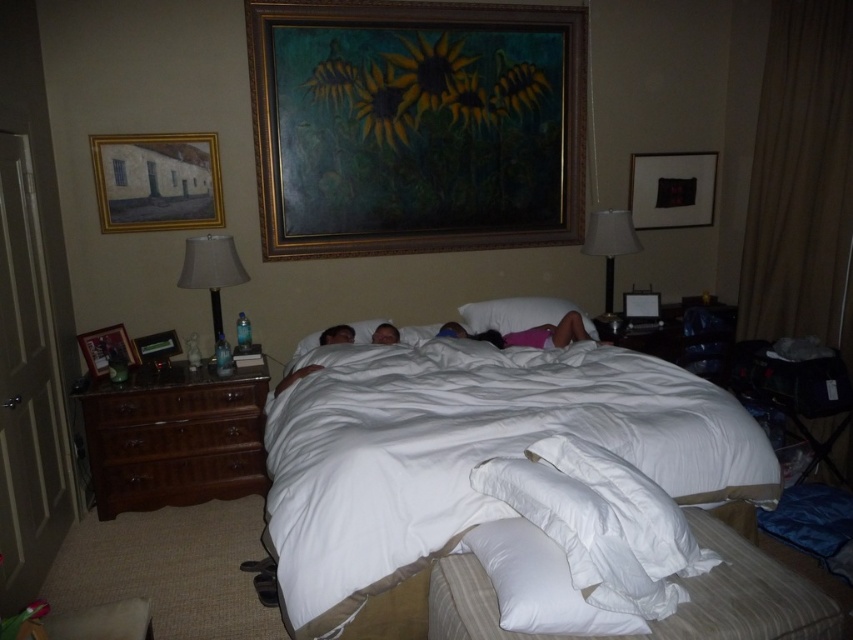
Question: Is black fabric picture frame at upper right below matte black picture frame at center?

Choices:
 (A) no
 (B) yes

Answer: (A)

Question: Can you confirm if white soft bedcover at center is positioned below matte black picture frame at left?

Choices:
 (A) yes
 (B) no

Answer: (A)

Question: Based on their relative distances, which object is farther from the white soft pillow at lower center?

Choices:
 (A) smooth skin face at center
 (B) gold-framed painting at upper center

Answer: (B)

Question: Which of the following is the farthest from the observer?

Choices:
 (A) white soft bedcover at center
 (B) brown wood dresser at left
 (C) matte black picture frame at center

Answer: (C)

Question: From the image, what is the correct spatial relationship of white soft bedsheet at center in relation to matte black picture frame at left?

Choices:
 (A) above
 (B) below

Answer: (B)

Question: Estimate the real-world distances between objects in this image. Which object is closer to the white soft pillow at lower center?

Choices:
 (A) brown wood dresser at left
 (B) black fabric picture frame at upper right
 (C) matte black picture frame at left

Answer: (A)